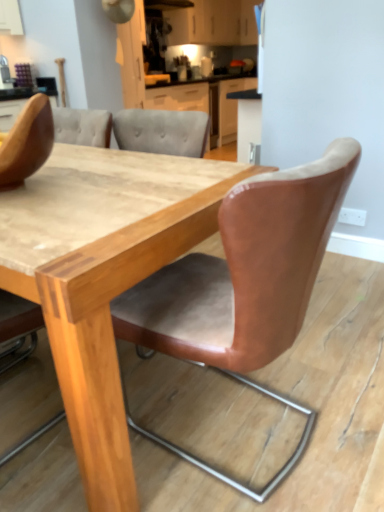
At what (x,y) coordinates should I click in order to perform the action: click on vacant area in front of brown leather chair at upper left, which is counted as the 1th chair, starting from the left. Please return your answer as a coordinate pair (x, y). The image size is (384, 512). Looking at the image, I should click on (42, 211).